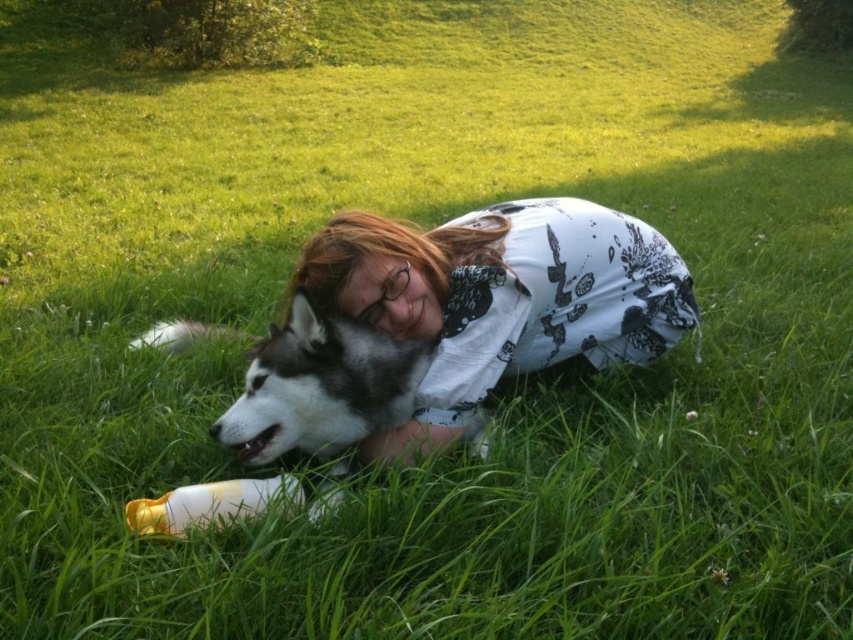
From the picture: You are a photographer trying to capture a photo of the white printed shirt at center and the yellow plastic bottle at lower left. Since you want both objects to appear equally tall in the photo, which object should you move closer to the camera?

The yellow plastic bottle at lower left is much shorter than the white printed shirt at center. To make them appear equally tall in the photo, you should move the yellow plastic bottle at lower left closer to the camera.